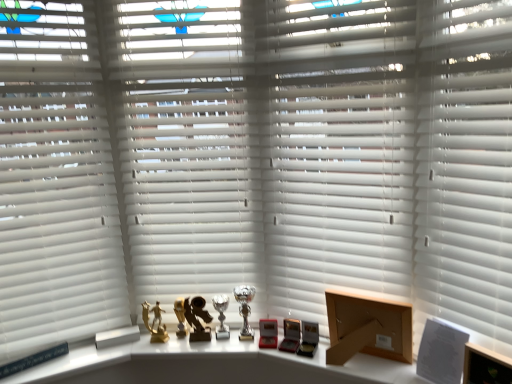
Locate an element on the screen. Image resolution: width=512 pixels, height=384 pixels. free spot in front of gold metallic figurine at center, which is counted as the second toy, starting from the right is located at coordinates (155, 349).